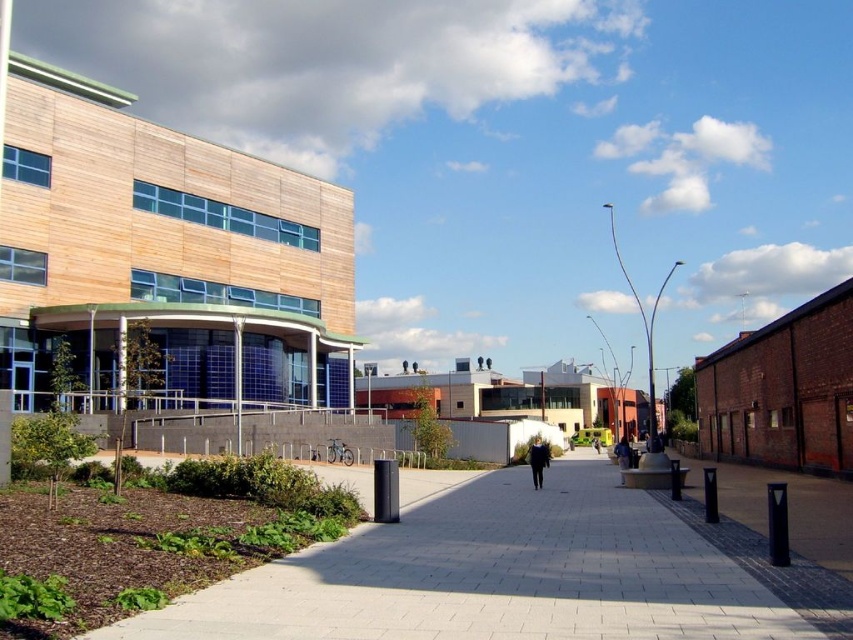
Who is positioned more to the left, dark blue jacket at center or black fabric jacket at center?

dark blue jacket at center

Between dark blue jacket at center and black fabric jacket at center, which one is positioned lower?

Positioned lower is black fabric jacket at center.

Does point (537, 449) lie in front of point (595, 451)?

Yes, it is.

Where is `dark blue jacket at center`? Image resolution: width=853 pixels, height=640 pixels. dark blue jacket at center is located at coordinates (537, 460).

Between smooth concrete pavement at center and black fabric jacket at center, which one appears on the right side from the viewer's perspective?

From the viewer's perspective, black fabric jacket at center appears more on the right side.

What do you see at coordinates (492, 572) in the screenshot?
I see `smooth concrete pavement at center` at bounding box center [492, 572].

At what (x,y) coordinates should I click in order to perform the action: click on smooth concrete pavement at center. Please return your answer as a coordinate pair (x, y). Looking at the image, I should click on (492, 572).

Does smooth concrete pavement at center appear over dark blue jacket at center?

Correct, smooth concrete pavement at center is located above dark blue jacket at center.

Which is below, smooth concrete pavement at center or dark blue jacket at center?

dark blue jacket at center is lower down.

Find the location of `smooth concrete pavement at center`. smooth concrete pavement at center is located at coordinates (492, 572).